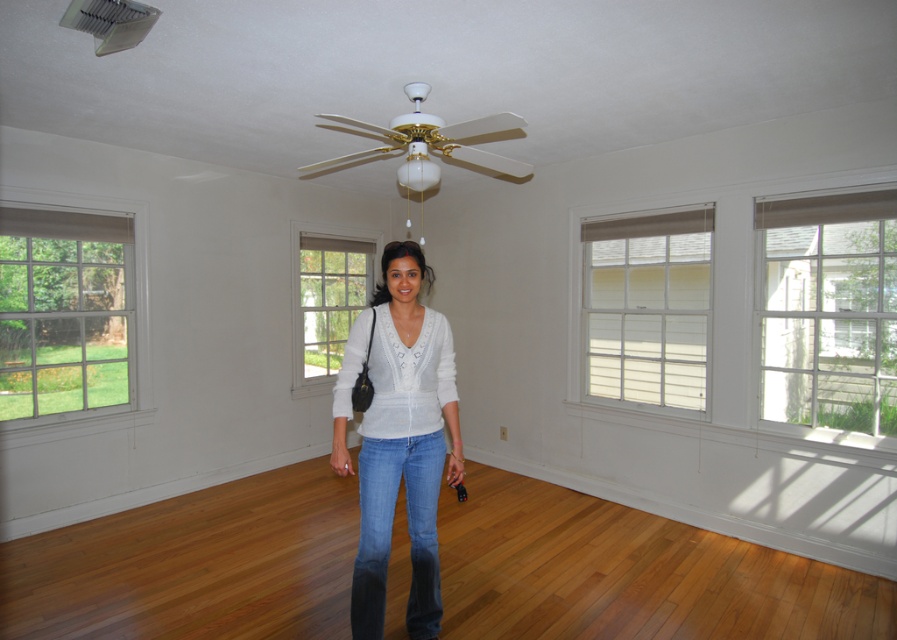
Is white knit sweater at center below white glossy ceiling fan at upper center?

Yes.

Does white knit sweater at center have a lesser width compared to white glossy ceiling fan at upper center?

Yes, white knit sweater at center is thinner than white glossy ceiling fan at upper center.

What are the coordinates of `white knit sweater at center` in the screenshot? It's located at (399, 440).

At what (x,y) coordinates should I click in order to perform the action: click on white knit sweater at center. Please return your answer as a coordinate pair (x, y). This screenshot has height=640, width=897. Looking at the image, I should click on (399, 440).

Is white knit sweater at center to the right of denim at center from the viewer's perspective?

A: Correct, you'll find white knit sweater at center to the right of denim at center.

This screenshot has height=640, width=897. I want to click on white knit sweater at center, so click(399, 440).

Measure the distance between point (384, 554) and camera.

Point (384, 554) and camera are 7.47 feet apart.

Image resolution: width=897 pixels, height=640 pixels. In order to click on white knit sweater at center in this screenshot , I will do `click(399, 440)`.

Between point (363, 483) and point (455, 156), which one is positioned in front?

Positioned in front is point (363, 483).

Does denim at center come behind white glossy ceiling fan at upper center?

No, denim at center is closer to the viewer.

Between point (423, 518) and point (395, 176), which one is positioned behind?

The point (395, 176) is behind.

At what (x,y) coordinates should I click in order to perform the action: click on denim at center. Please return your answer as a coordinate pair (x, y). The image size is (897, 640). Looking at the image, I should click on (390, 531).